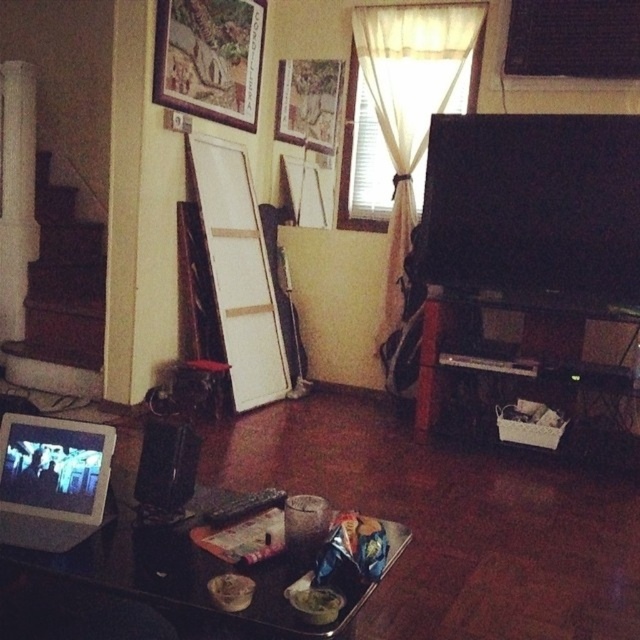
Does point (426, 68) lie behind point (340, 61)?

No, it is not.

Is white sheer curtain at upper center above wooden picture frame at upper center?

No.

Between point (412, 164) and point (316, 128), which one is positioned in front?

Point (412, 164) is more forward.

What are the coordinates of `white sheer curtain at upper center` in the screenshot? It's located at (410, 104).

Does matte silver laptop at lower left have a greater width compared to wooden textured picture frame at upper center?

Incorrect, matte silver laptop at lower left's width does not surpass wooden textured picture frame at upper center's.

Which is above, matte silver laptop at lower left or wooden textured picture frame at upper center?

wooden textured picture frame at upper center is above.

You are a GUI agent. You are given a task and a screenshot of the screen. Output one action in this format:
    pyautogui.click(x=<x>, y=<y>)
    Task: Click on the matte silver laptop at lower left
    
    Given the screenshot: What is the action you would take?
    pyautogui.click(x=51, y=481)

Locate an element on the screen. matte silver laptop at lower left is located at coordinates (51, 481).

Is white matte easel at center below matte silver laptop at lower left?

No.

What do you see at coordinates (237, 272) in the screenshot? This screenshot has height=640, width=640. I see `white matte easel at center` at bounding box center [237, 272].

This screenshot has width=640, height=640. In order to click on white matte easel at center in this screenshot , I will do `click(237, 272)`.

Find the location of a particular element. white matte easel at center is located at coordinates (237, 272).